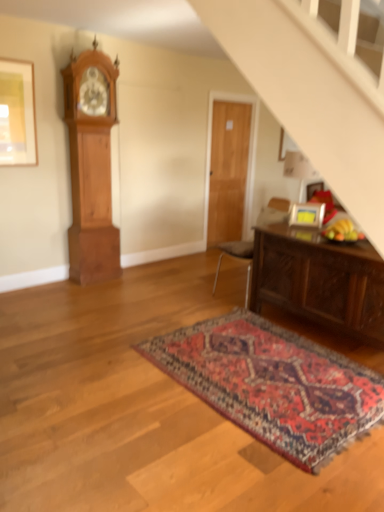
In order to face matte gold picture frame at upper right, positioned as the second picture frame in top-to-bottom order, should I rotate leftwards or rightwards?

To face it directly, rotate right by 15.172 degrees.

Image resolution: width=384 pixels, height=512 pixels. What do you see at coordinates (274, 211) in the screenshot?
I see `brown leather chair at center` at bounding box center [274, 211].

This screenshot has width=384, height=512. What do you see at coordinates (320, 280) in the screenshot?
I see `dark brown wooden table at lower right` at bounding box center [320, 280].

In the scene shown: Measure the distance between wooden door at center and camera.

The depth of wooden door at center is 5.40 meters.

I want to click on matte gold picture frame at upper right, the first picture frame from the bottom, so click(x=307, y=215).

Considering the positions of objects matte gold picture frame at upper right, which is the first picture frame from right to left, and wooden grandfather clock at left in the image provided, who is more to the right, matte gold picture frame at upper right, which is the first picture frame from right to left, or wooden grandfather clock at left?

matte gold picture frame at upper right, which is the first picture frame from right to left, is more to the right.

From a real-world perspective, which is physically above, matte gold picture frame at upper right, the first picture frame from the bottom, or wooden grandfather clock at left?

wooden grandfather clock at left.

Considering the sizes of objects matte gold picture frame at upper right, the first picture frame from the bottom, and wooden grandfather clock at left in the image provided, who is smaller, matte gold picture frame at upper right, the first picture frame from the bottom, or wooden grandfather clock at left?

matte gold picture frame at upper right, the first picture frame from the bottom, is smaller.

Can you tell me how much matte gold picture frame at upper right, positioned as the second picture frame in top-to-bottom order, and wooden grandfather clock at left differ in facing direction?

There is a 57.7-degree angle between the facing directions of matte gold picture frame at upper right, positioned as the second picture frame in top-to-bottom order, and wooden grandfather clock at left.

Would you say dark brown wooden table at lower right is part of brown leather chair at center's contents?

That's incorrect, dark brown wooden table at lower right is not inside brown leather chair at center.

From the picture: Considering the relative sizes of brown leather chair at center and dark brown wooden table at lower right in the image provided, is brown leather chair at center taller than dark brown wooden table at lower right?

Yes.

Considering their positions, is brown leather chair at center located in front of or behind dark brown wooden table at lower right?

brown leather chair at center is positioned farther from the viewer than dark brown wooden table at lower right.

Is brown leather chair at center oriented away from dark brown wooden table at lower right?

No, brown leather chair at center is not facing away from dark brown wooden table at lower right.

Are matte gold picture frame at upper left, the second picture frame ordered from the bottom, and wooden grandfather clock at left making contact?

matte gold picture frame at upper left, the second picture frame ordered from the bottom, and wooden grandfather clock at left are clearly separated.

From a real-world perspective, is matte gold picture frame at upper left, positioned as the first picture frame in left-to-right order, physically located above or below wooden grandfather clock at left?

matte gold picture frame at upper left, positioned as the first picture frame in left-to-right order, is situated higher than wooden grandfather clock at left in the real world.

Is matte gold picture frame at upper left, the second picture frame ordered from the bottom, oriented towards wooden grandfather clock at left?

No, matte gold picture frame at upper left, the second picture frame ordered from the bottom, is not oriented towards wooden grandfather clock at left.

Which of these two, matte gold picture frame at upper left, the second picture frame ordered from the bottom, or wooden grandfather clock at left, is bigger?

wooden grandfather clock at left.

How distant is wooden grandfather clock at left from carpeted rug at center?

wooden grandfather clock at left and carpeted rug at center are 2.13 meters apart.

Can you confirm if wooden grandfather clock at left is wider than carpeted rug at center?

No.

From a real-world perspective, is wooden grandfather clock at left on top of carpeted rug at center?

Yes, from a real-world perspective, wooden grandfather clock at left is over carpeted rug at center

Which is behind, wooden grandfather clock at left or carpeted rug at center?

Positioned behind is wooden grandfather clock at left.

Could matte gold picture frame at upper right, which ranks as the 2th picture frame in left-to-right order, be considered to be inside dark brown wooden table at lower right?

No, matte gold picture frame at upper right, which ranks as the 2th picture frame in left-to-right order, is located outside of dark brown wooden table at lower right.

Considering the sizes of objects dark brown wooden table at lower right and matte gold picture frame at upper right, which is the first picture frame from right to left, in the image provided, who is wider, dark brown wooden table at lower right or matte gold picture frame at upper right, which is the first picture frame from right to left,?

With larger width is dark brown wooden table at lower right.

Which of these two, dark brown wooden table at lower right or matte gold picture frame at upper right, which is the first picture frame from right to left, stands shorter?

matte gold picture frame at upper right, which is the first picture frame from right to left, is shorter.

Based on the photo, how different are the orientations of dark brown wooden table at lower right and matte gold picture frame at upper right, which is the first picture frame from right to left, in degrees?

34.2 degrees separate the facing orientations of dark brown wooden table at lower right and matte gold picture frame at upper right, which is the first picture frame from right to left.

The width and height of the screenshot is (384, 512). I want to click on picture frame that appears on the left of matte gold picture frame at upper right, which is the first picture frame from right to left, so click(17, 113).

Between matte gold picture frame at upper right, positioned as the second picture frame in top-to-bottom order, and matte gold picture frame at upper left, the second picture frame ordered from the bottom, which one appears on the left side from the viewer's perspective?

Positioned to the left is matte gold picture frame at upper left, the second picture frame ordered from the bottom.

Based on their sizes in the image, would you say matte gold picture frame at upper right, which ranks as the 2th picture frame in left-to-right order, is bigger or smaller than matte gold picture frame at upper left, marked as the 2th picture frame in a right-to-left arrangement?

Considering their sizes, matte gold picture frame at upper right, which ranks as the 2th picture frame in left-to-right order, takes up less space than matte gold picture frame at upper left, marked as the 2th picture frame in a right-to-left arrangement.

Which point is more forward, (314, 225) or (12, 95)?

Positioned in front is point (314, 225).

Is matte gold picture frame at upper left, which appears as the 1th picture frame when viewed from the top, located outside carpeted rug at center?

matte gold picture frame at upper left, which appears as the 1th picture frame when viewed from the top, lies outside carpeted rug at center's area.

Is matte gold picture frame at upper left, positioned as the first picture frame in left-to-right order, directly adjacent to carpeted rug at center?

No, matte gold picture frame at upper left, positioned as the first picture frame in left-to-right order, is not with carpeted rug at center.

From the image's perspective, is matte gold picture frame at upper left, which appears as the 1th picture frame when viewed from the top, beneath carpeted rug at center?

No, from the image's perspective, matte gold picture frame at upper left, which appears as the 1th picture frame when viewed from the top, is not below carpeted rug at center.

Is point (30, 95) farther from camera compared to point (273, 328)?

Yes.

Locate an element on the screen. clock on the left of matte gold picture frame at upper right, which ranks as the 2th picture frame in left-to-right order is located at coordinates pos(91,165).

Find the location of a particular element. The image size is (384, 512). chair that appears above the dark brown wooden table at lower right (from a real-world perspective) is located at coordinates (274, 211).

From the image, which object appears to be nearer to wooden door at center, brown leather chair at center or matte gold picture frame at upper left, positioned as the first picture frame in left-to-right order?

brown leather chair at center lies closer to wooden door at center than the other object.

Based on their spatial positions, is carpeted rug at center or matte gold picture frame at upper right, the first picture frame from the bottom, further from wooden door at center?

Among the two, carpeted rug at center is located further to wooden door at center.

From the image, which object appears to be nearer to matte gold picture frame at upper left, positioned as the first picture frame in left-to-right order, wooden grandfather clock at left or wooden door at center?

wooden grandfather clock at left.

Estimate the real-world distances between objects in this image. Which object is further from wooden grandfather clock at left, dark brown wooden table at lower right or matte gold picture frame at upper right, positioned as the second picture frame in top-to-bottom order?

dark brown wooden table at lower right.

Looking at the image, which one is located closer to matte gold picture frame at upper right, which is the first picture frame from right to left, matte gold picture frame at upper left, positioned as the first picture frame in left-to-right order, or wooden grandfather clock at left?

wooden grandfather clock at left.

From the image, which object appears to be farther from matte gold picture frame at upper left, marked as the 2th picture frame in a right-to-left arrangement, wooden door at center or dark brown wooden table at lower right?

dark brown wooden table at lower right is further to matte gold picture frame at upper left, marked as the 2th picture frame in a right-to-left arrangement.

When comparing their distances from matte gold picture frame at upper right, the first picture frame from the bottom, does brown leather chair at center or matte gold picture frame at upper left, which appears as the 1th picture frame when viewed from the top, seem further?

matte gold picture frame at upper left, which appears as the 1th picture frame when viewed from the top.

Looking at the image, which one is located further to matte gold picture frame at upper left, positioned as the first picture frame in left-to-right order, matte gold picture frame at upper right, positioned as the second picture frame in top-to-bottom order, or carpeted rug at center?

carpeted rug at center lies further to matte gold picture frame at upper left, positioned as the first picture frame in left-to-right order, than the other object.

Locate an element on the screen. The image size is (384, 512). clock located between carpeted rug at center and wooden door at center in the depth direction is located at coordinates click(91, 165).

You are a GUI agent. You are given a task and a screenshot of the screen. Output one action in this format:
    pyautogui.click(x=<x>, y=<y>)
    Task: Click on the mat situated between matte gold picture frame at upper left, which appears as the 1th picture frame when viewed from the top, and brown leather chair at center from left to right
    The image size is (384, 512).
    Given the screenshot: What is the action you would take?
    pyautogui.click(x=273, y=384)

What are the coordinates of `door situated between wooden grandfather clock at left and matte gold picture frame at upper right, which is the first picture frame from right to left, from left to right` in the screenshot? It's located at (228, 170).

Identify the location of chair situated between wooden grandfather clock at left and dark brown wooden table at lower right from left to right. The height and width of the screenshot is (512, 384). (274, 211).